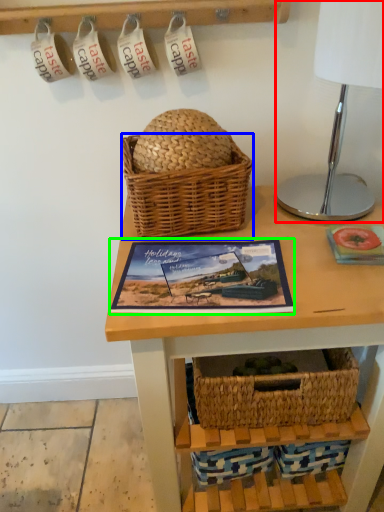
Question: Which object is the farthest from table lamp (highlighted by a red box)? Choose among these: picnic basket (highlighted by a blue box) or picture frame (highlighted by a green box).

Choices:
 (A) picnic basket
 (B) picture frame

Answer: (B)